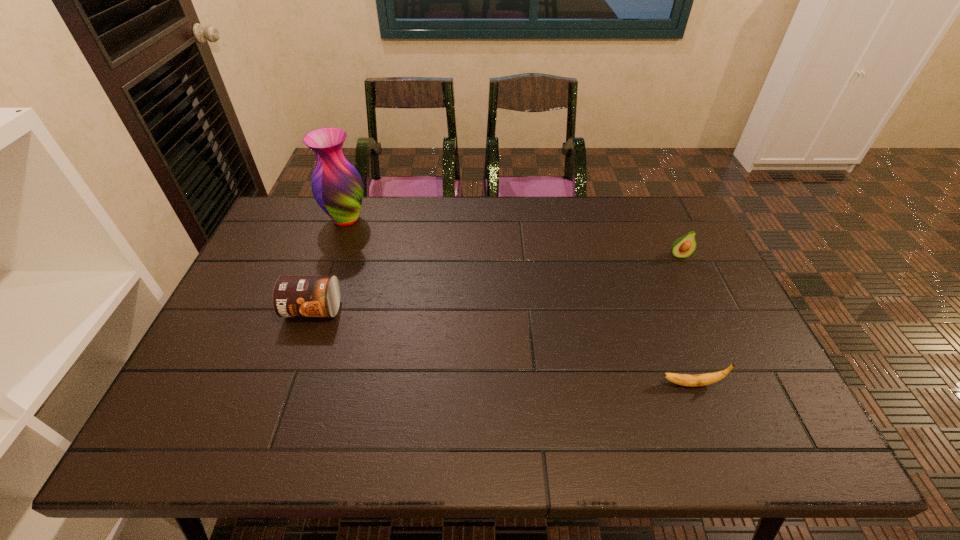
The height and width of the screenshot is (540, 960). Identify the location of vacant space located 0.290m on the peel of the second object from right to left from the top. (537, 384).

Where is `vacant space located 0.360m on the peel of the second object from right to left from the top`? The height and width of the screenshot is (540, 960). vacant space located 0.360m on the peel of the second object from right to left from the top is located at coordinates (508, 384).

You are a GUI agent. You are given a task and a screenshot of the screen. Output one action in this format:
    pyautogui.click(x=<x>, y=<y>)
    Task: Click on the vacant region located on the peel of the second object from right to left from the top
    Image resolution: width=960 pixels, height=540 pixels.
    Given the screenshot: What is the action you would take?
    pyautogui.click(x=524, y=384)

Find the location of a particular element. object that is at the far edge is located at coordinates (337, 187).

Identify the location of avocado that is at the right edge. The width and height of the screenshot is (960, 540). (683, 247).

The width and height of the screenshot is (960, 540). In order to click on banana located in the right edge section of the desktop in this screenshot , I will do `click(696, 380)`.

Image resolution: width=960 pixels, height=540 pixels. In the image, there is a desktop. Identify the location of vacant region at the far edge. (631, 239).

In the image, there is a desktop. Where is `vacant area at the near edge`? The height and width of the screenshot is (540, 960). vacant area at the near edge is located at coordinates (696, 443).

This screenshot has height=540, width=960. In order to click on vacant area at the left edge of the desktop in this screenshot , I will do `click(189, 376)`.

Where is `vacant space at the right edge`? This screenshot has width=960, height=540. vacant space at the right edge is located at coordinates (768, 380).